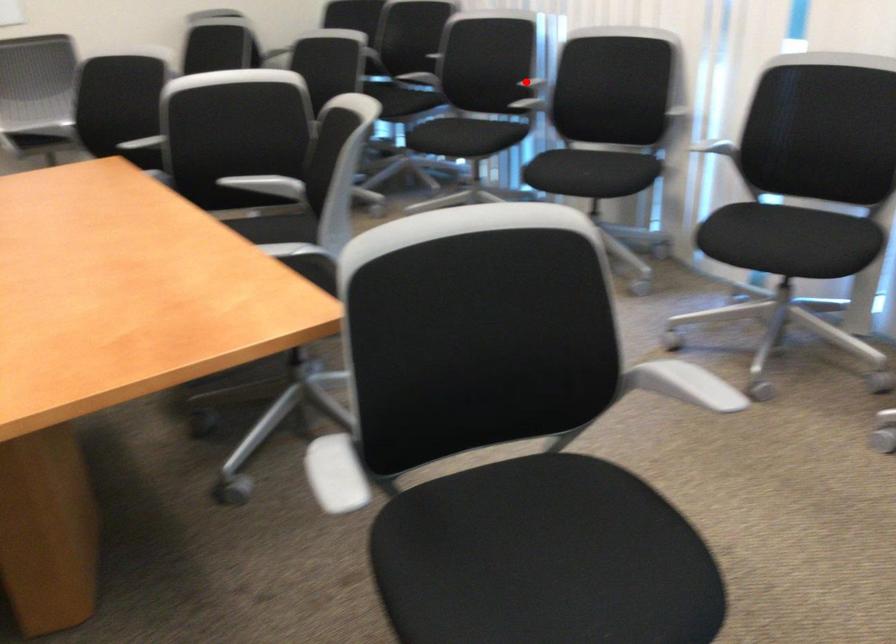
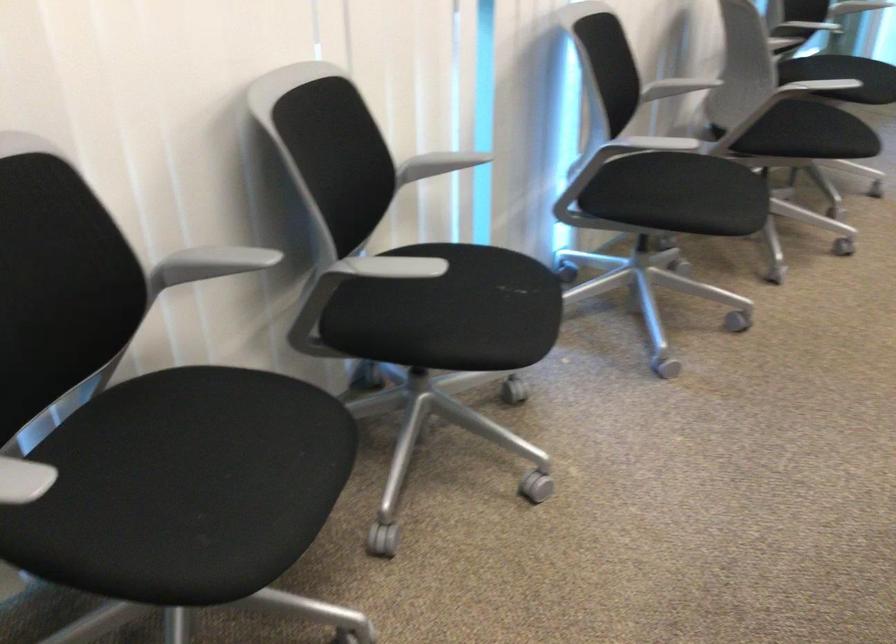
Locate, in the second image, the point that corresponds to the highlighted location in the first image.

(211, 263)